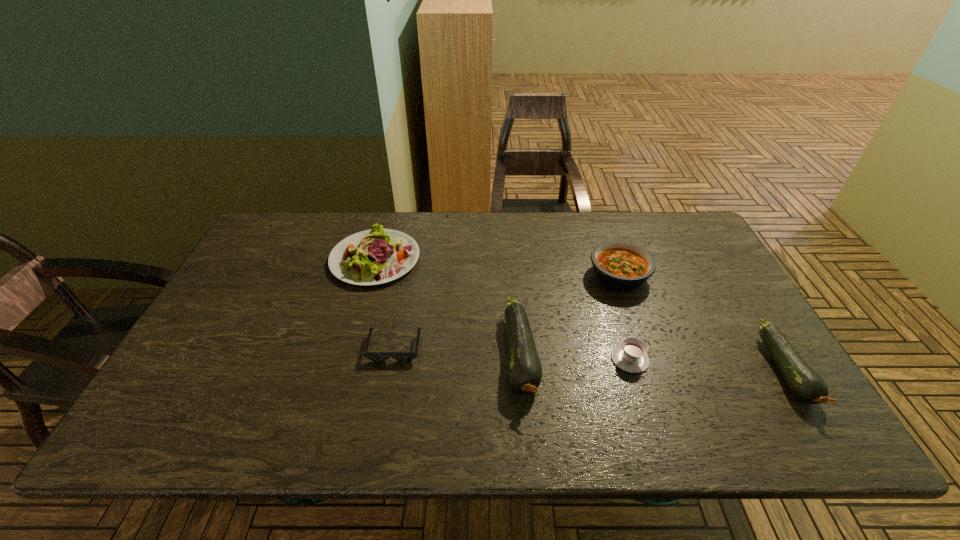
With all zucchinis evenly spaced, where should an extra zucchini be placed on the left to continue the pattern? Please point out a vacant space. Please provide its 2D coordinates. Your answer should be formatted as a tuple, i.e. [(x, y)], where the tuple contains the x and y coordinates of a point satisfying the conditions above.

[(272, 341)]